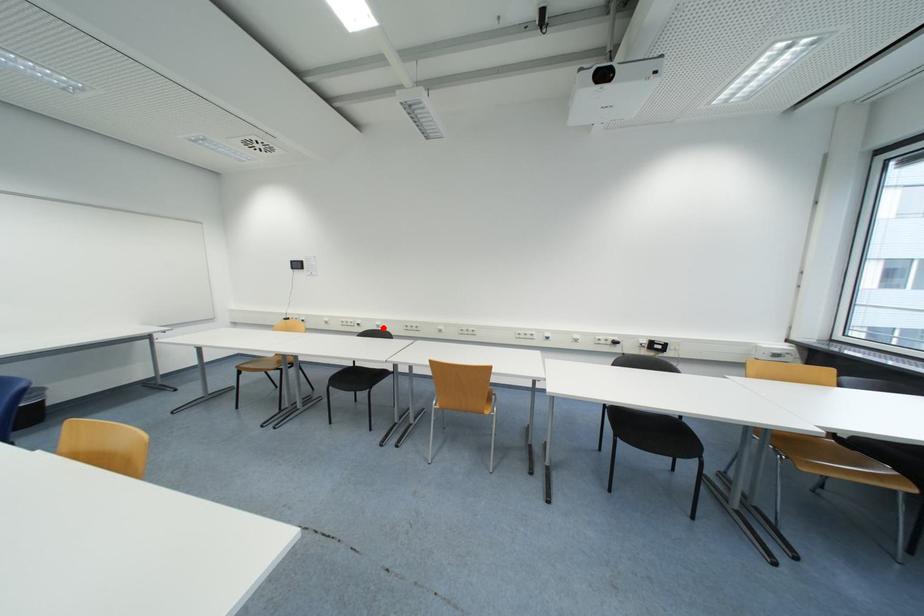
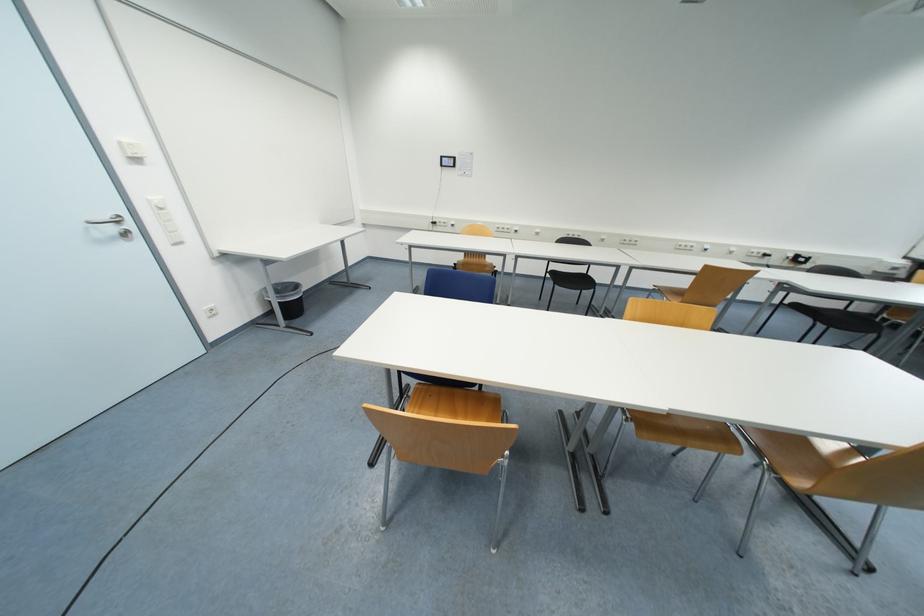
The point at the highlighted location is marked in the first image. Where is the corresponding point in the second image?

(541, 236)